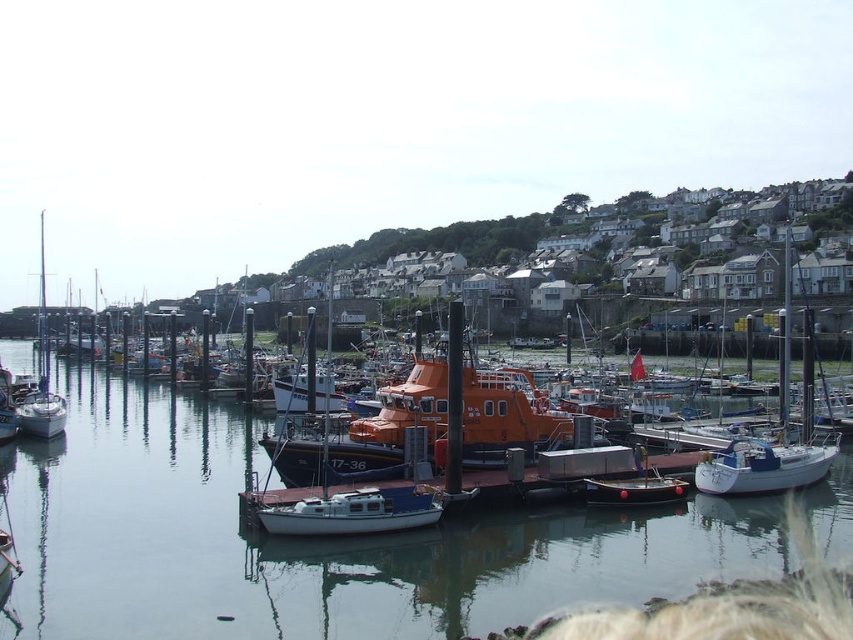
You are a harbor worker who needs to board the white glossy sailboat at right and the white matte sailboat at left. Which boat can you reach first without moving around the large orange lifeboat in the center?

The white glossy sailboat at right can be reached first because it is positioned in front of the white matte sailboat at left, making it more accessible without needing to go around the large orange lifeboat in the center.